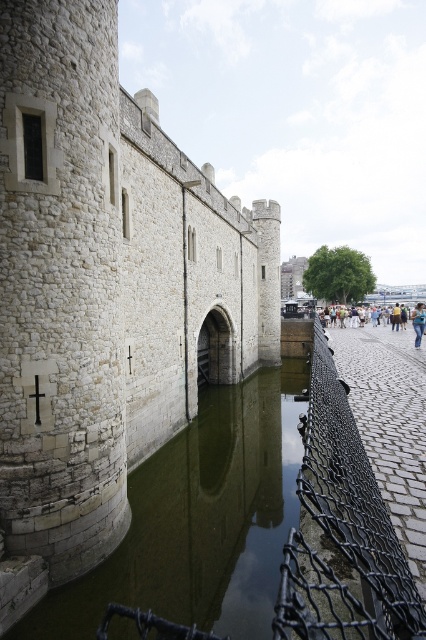
Question: Estimate the real-world distances between objects in this image. Which object is farther from the blue denim jeans at center?

Choices:
 (A) white stone castle at center
 (B) black chain-link fence at lower right

Answer: (B)

Question: From the image, what is the correct spatial relationship of white stone castle at center in relation to blue denim jeans at center?

Choices:
 (A) left
 (B) right

Answer: (A)

Question: Can you confirm if greenish stone waterway at center is positioned to the right of blue denim jeans at center?

Choices:
 (A) yes
 (B) no

Answer: (B)

Question: Which point is closer to the camera taking this photo?

Choices:
 (A) (328, 532)
 (B) (416, 321)
 (C) (204, 536)
 (D) (68, 305)

Answer: (A)

Question: Does white stone castle at center have a smaller size compared to greenish stone waterway at center?

Choices:
 (A) no
 (B) yes

Answer: (A)

Question: Which of the following is the closest to the observer?

Choices:
 (A) pyautogui.click(x=86, y=612)
 (B) pyautogui.click(x=419, y=344)
 (C) pyautogui.click(x=163, y=412)

Answer: (A)